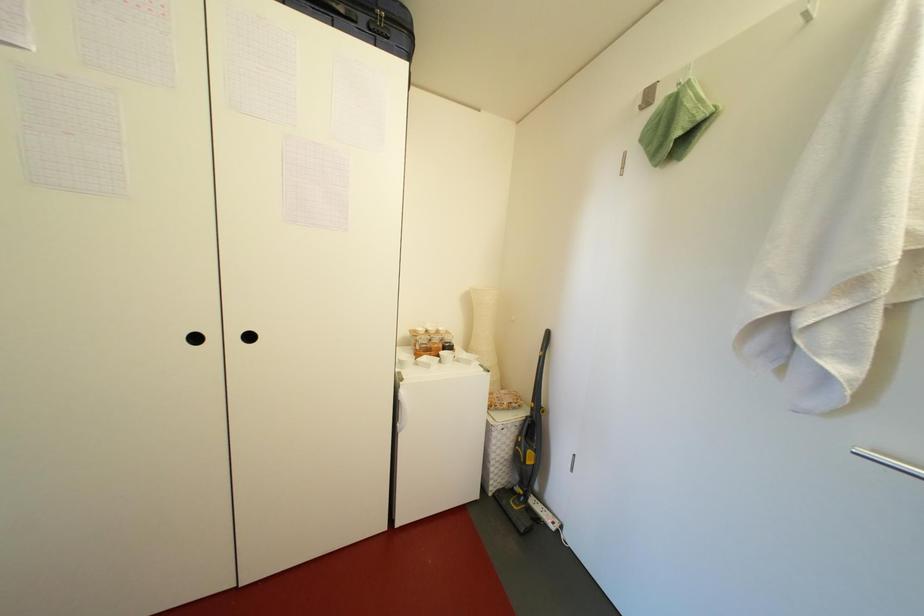
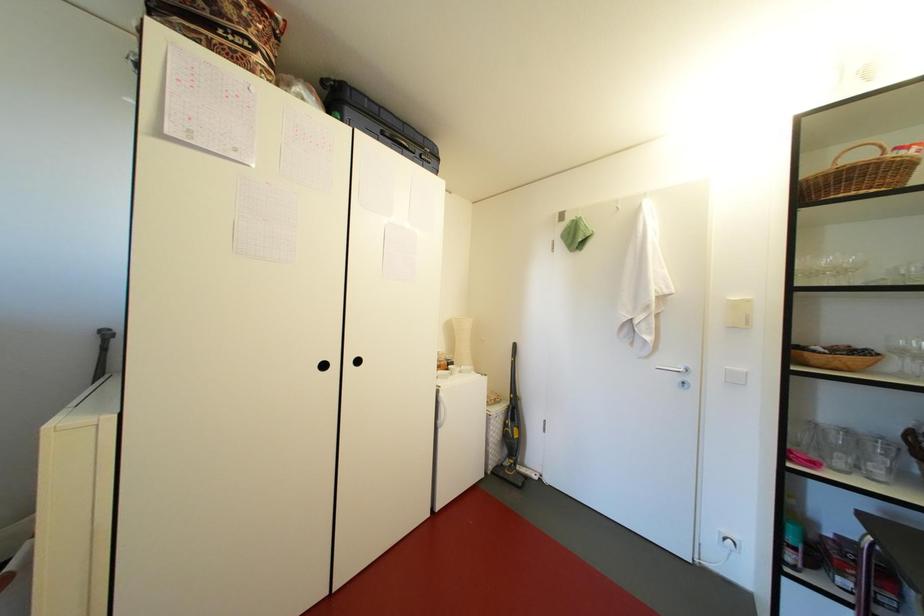
Question: The first image is from the beginning of the video and the second image is from the end. How did the camera likely rotate when shooting the video?

Choices:
 (A) Left
 (B) Right
 (C) Up
 (D) Down

Answer: (B)